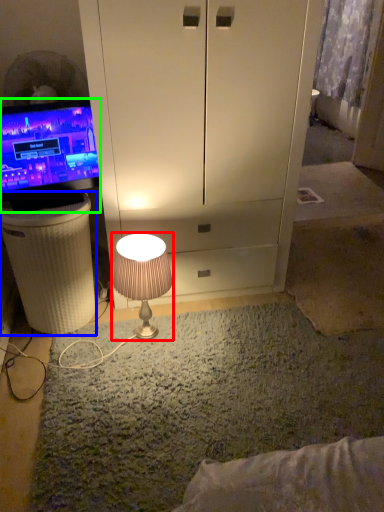
Question: Which is farther away from lamp (highlighted by a red box)? vanity (highlighted by a blue box) or television (highlighted by a green box)?

Choices:
 (A) vanity
 (B) television

Answer: (B)